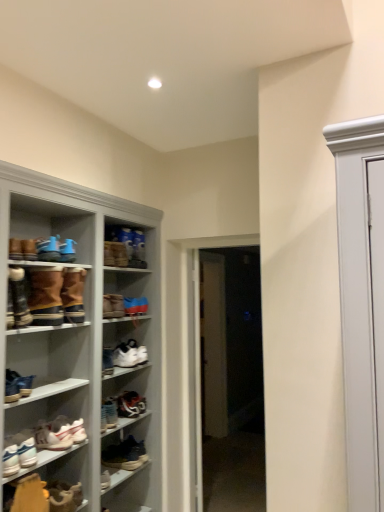
Question: Considering the positions of brown suede boots at left, which ranks as the 5th footwear in top-to-bottom order, and brown suede boot at center, the 3th footwear when ordered from top to bottom, in the image, is brown suede boots at left, which ranks as the 5th footwear in top-to-bottom order, bigger or smaller than brown suede boot at center, the 3th footwear when ordered from top to bottom,?

Choices:
 (A) small
 (B) big

Answer: (B)

Question: Do you think brown suede boots at left, which ranks as the 5th footwear in top-to-bottom order, is within brown suede boot at center, the 3th footwear when ordered from top to bottom, or outside of it?

Choices:
 (A) inside
 (B) outside

Answer: (B)

Question: Estimate the real-world distances between objects in this image. Which object is farther from the brown suede boots at left, acting as the 8th footwear starting from the bottom?

Choices:
 (A) brown suede boot at upper center, which is the first footwear from top to bottom
 (B) shiny black sneaker at center, the fourth footwear in the bottom-to-top sequence
 (C) white glossy door at center, which is counted as the second door, starting from the right
 (D) blue suede sneakers at upper left, acting as the 2th footwear starting from the top
 (E) white glossy door at center, marked as the 1th door in a right-to-left arrangement

Answer: (E)

Question: Estimate the real-world distances between objects in this image. Which object is closer to the matte white sneaker at lower left, the seventh footwear positioned from the bottom?

Choices:
 (A) brown suede boots at left, acting as the 8th footwear starting from the bottom
 (B) white leather sneaker at center, the 6th footwear from the bottom
 (C) leather boot at lower left, the 2th footwear in the bottom-to-top sequence
 (D) leather boot at lower left, placed as the 3th footwear when sorted from bottom to top
 (E) leather boot at left, acting as the 10th footwear starting from the bottom

Answer: (E)